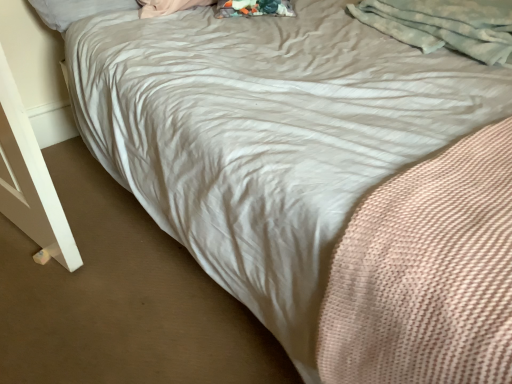
At what (x,y) coordinates should I click in order to perform the action: click on white soft pillow at upper left. Please return your answer as a coordinate pair (x, y). Looking at the image, I should click on (76, 10).

The width and height of the screenshot is (512, 384). What do you see at coordinates (76, 10) in the screenshot?
I see `white soft pillow at upper left` at bounding box center [76, 10].

In order to face white soft pillow at upper left, should I rotate leftwards or rightwards?

To align with it, rotate left about 20.983°.

At what (x,y) coordinates should I click in order to perform the action: click on light gray fluffy blanket at upper right. Please return your answer as a coordinate pair (x, y). This screenshot has width=512, height=384. Looking at the image, I should click on (444, 24).

The height and width of the screenshot is (384, 512). What do you see at coordinates (444, 24) in the screenshot?
I see `light gray fluffy blanket at upper right` at bounding box center [444, 24].

Locate an element on the screen. This screenshot has width=512, height=384. white soft pillow at upper left is located at coordinates (76, 10).

Can you confirm if light gray fluffy blanket at upper right is positioned to the left of white soft pillow at upper left?

No, light gray fluffy blanket at upper right is not to the left of white soft pillow at upper left.

Is light gray fluffy blanket at upper right positioned before white soft pillow at upper left?

Yes.

Considering the positions of points (506, 12) and (45, 14), is point (506, 12) closer to camera compared to point (45, 14)?

Yes, it is in front of point (45, 14).

From the image's perspective, which one is positioned higher, light gray fluffy blanket at upper right or white soft pillow at upper left?

white soft pillow at upper left is shown above in the image.

From a real-world perspective, does light gray fluffy blanket at upper right sit lower than white soft pillow at upper left?

No, from a real-world perspective, light gray fluffy blanket at upper right is not below white soft pillow at upper left.

Which of these two, light gray fluffy blanket at upper right or white soft pillow at upper left, is wider?

With larger width is light gray fluffy blanket at upper right.

Can you confirm if light gray fluffy blanket at upper right is shorter than white soft pillow at upper left?

No.

Who is bigger, light gray fluffy blanket at upper right or white soft pillow at upper left?

Bigger between the two is light gray fluffy blanket at upper right.

Is light gray fluffy blanket at upper right spatially inside white soft pillow at upper left, or outside of it?

light gray fluffy blanket at upper right exists outside the volume of white soft pillow at upper left.

Looking at this image, is light gray fluffy blanket at upper right in contact with white soft pillow at upper left?

They are not placed beside each other.

Is light gray fluffy blanket at upper right oriented away from white soft pillow at upper left?

No, light gray fluffy blanket at upper right's orientation is not away from white soft pillow at upper left.

You are a GUI agent. You are given a task and a screenshot of the screen. Output one action in this format:
    pyautogui.click(x=<x>, y=<y>)
    Task: Click on the material that appears below the white soft pillow at upper left (from the image's perspective)
    The width and height of the screenshot is (512, 384).
    Given the screenshot: What is the action you would take?
    pyautogui.click(x=444, y=24)

Which is more to the right, white soft pillow at upper left or light gray fluffy blanket at upper right?

light gray fluffy blanket at upper right is more to the right.

Between white soft pillow at upper left and light gray fluffy blanket at upper right, which one is positioned in front?

light gray fluffy blanket at upper right is closer to the camera.

Does point (50, 2) come closer to viewer compared to point (385, 12)?

No, (50, 2) is further to viewer.

From the image's perspective, is white soft pillow at upper left positioned above or below light gray fluffy blanket at upper right?

white soft pillow at upper left is above light gray fluffy blanket at upper right.

From a real-world perspective, is white soft pillow at upper left on light gray fluffy blanket at upper right?

No, from a real-world perspective, white soft pillow at upper left is not on top of light gray fluffy blanket at upper right.

Does white soft pillow at upper left have a lesser width compared to light gray fluffy blanket at upper right?

Yes.

From the picture: Between white soft pillow at upper left and light gray fluffy blanket at upper right, which one has less height?

white soft pillow at upper left.

In terms of size, does white soft pillow at upper left appear bigger or smaller than light gray fluffy blanket at upper right?

Considering their sizes, white soft pillow at upper left takes up less space than light gray fluffy blanket at upper right.

Is light gray fluffy blanket at upper right completely or partially inside white soft pillow at upper left?

No, light gray fluffy blanket at upper right is not inside white soft pillow at upper left.

Are white soft pillow at upper left and light gray fluffy blanket at upper right beside each other?

No, white soft pillow at upper left is not in contact with light gray fluffy blanket at upper right.

Is white soft pillow at upper left looking in the opposite direction of light gray fluffy blanket at upper right?

No, white soft pillow at upper left is not facing the opposite direction of light gray fluffy blanket at upper right.

How different are the orientations of white soft pillow at upper left and light gray fluffy blanket at upper right in degrees?

0.723 degrees separate the facing orientations of white soft pillow at upper left and light gray fluffy blanket at upper right.

Where is `material in front of the white soft pillow at upper left`? The width and height of the screenshot is (512, 384). material in front of the white soft pillow at upper left is located at coordinates (444, 24).

I want to click on pillow behind the light gray fluffy blanket at upper right, so click(x=76, y=10).

At what (x,y) coordinates should I click in order to perform the action: click on pillow above the light gray fluffy blanket at upper right (from the image's perspective). Please return your answer as a coordinate pair (x, y). Looking at the image, I should click on (76, 10).